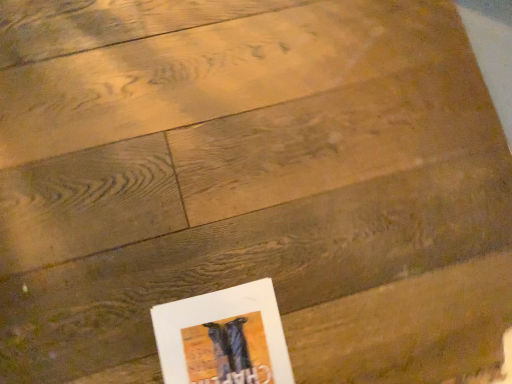
Image resolution: width=512 pixels, height=384 pixels. Identify the location of vacant space situated above white paper at lower center (from a real-world perspective). (224, 346).